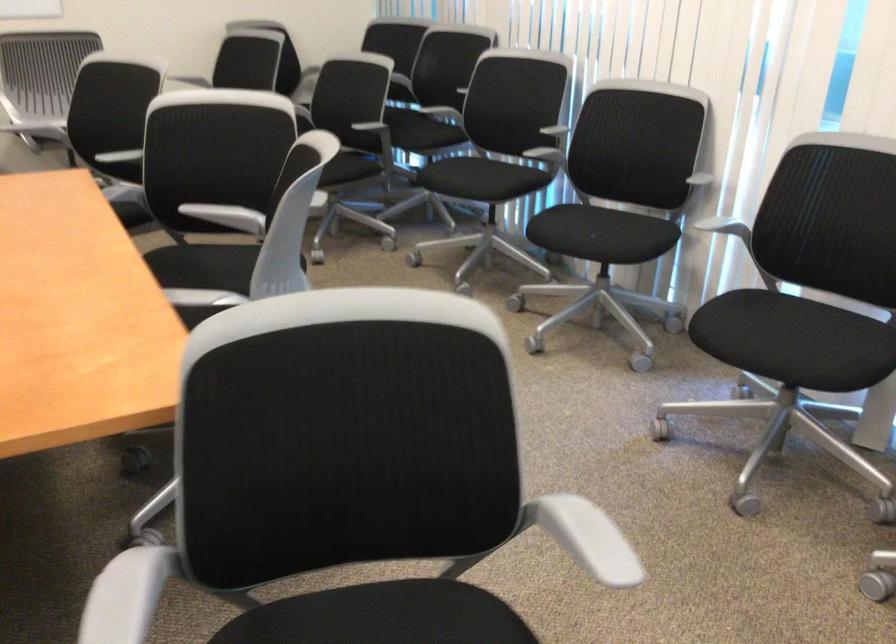
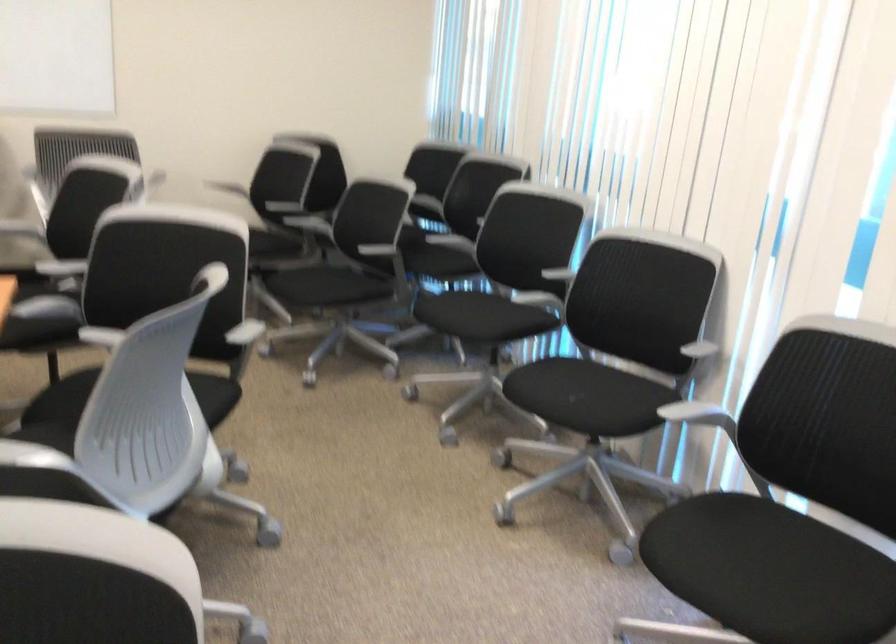
Question: Based on the continuous images, in which direction is the camera rotating? Reply with the corresponding letter.

Choices:
 (A) Left
 (B) Right
 (C) Up
 (D) Down

Answer: (C)